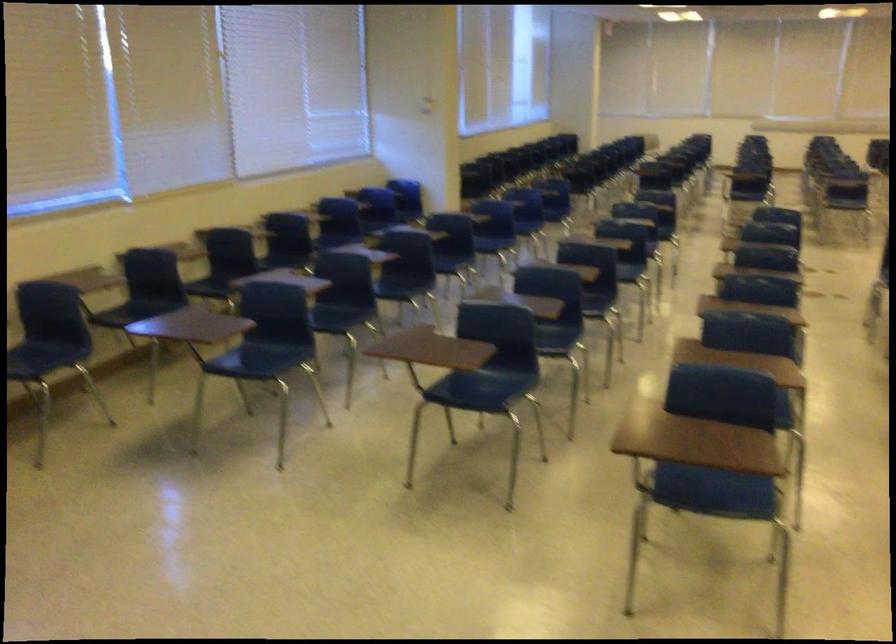
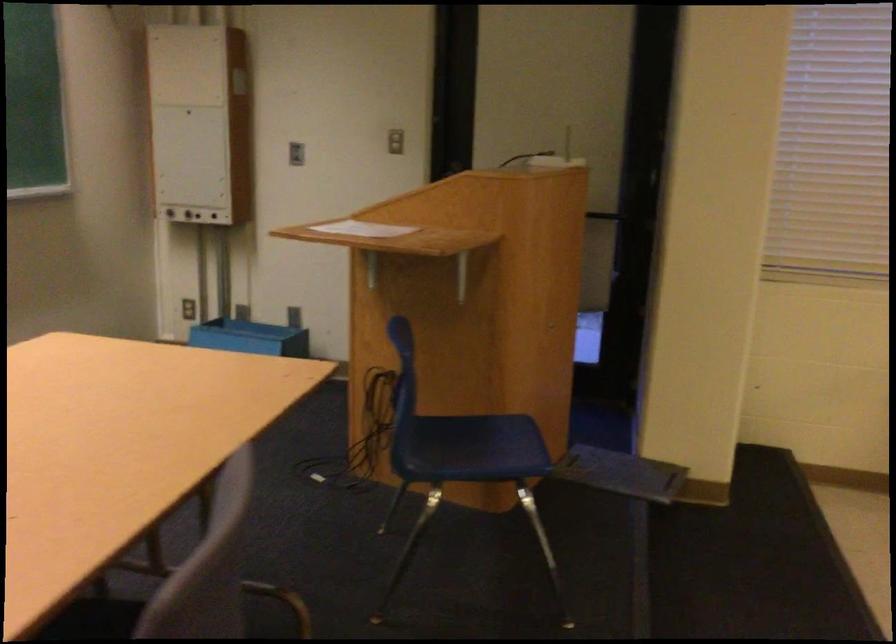
Question: The camera is either moving clockwise (left) or counter-clockwise (right) around the object. The first image is from the beginning of the video and the second image is from the end. Is the camera moving left or right when shooting the video?

Choices:
 (A) Left
 (B) Right

Answer: (B)